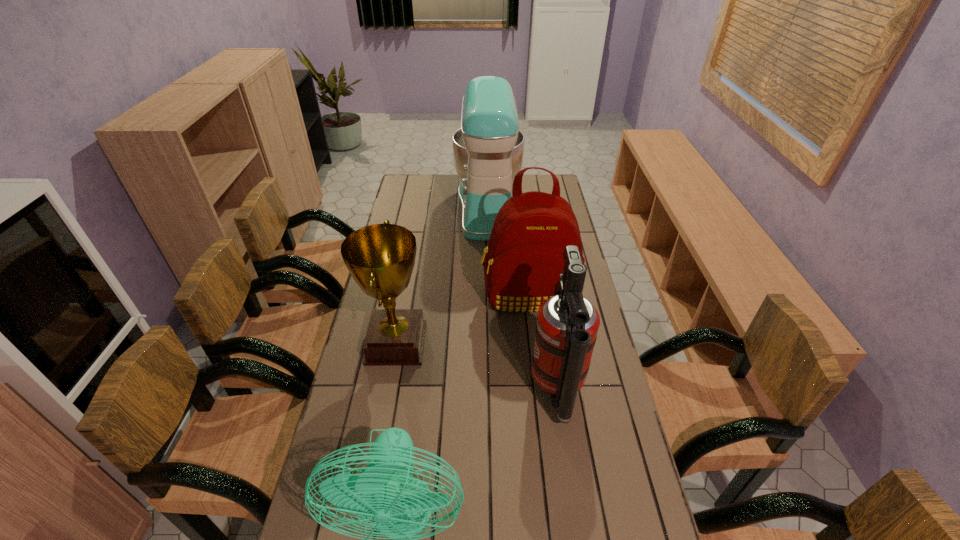
Locate an element on the screen. empty space that is in between the award and the fire extinguisher is located at coordinates (477, 367).

What are the coordinates of `the third closest object to the fire extinguisher` in the screenshot? It's located at (380, 257).

The height and width of the screenshot is (540, 960). What are the coordinates of `object that ranks as the closest to the award` in the screenshot? It's located at (524, 258).

In order to click on vacant space that satisfies the following two spatial constraints: 1. on the front-facing side of the backpack; 2. on the plaque of the award in this screenshot , I will do `click(535, 343)`.

Find the location of a particular element. The height and width of the screenshot is (540, 960). free space in the image that satisfies the following two spatial constraints: 1. on the front-facing side of the backpack; 2. on the plaque of the award is located at coordinates (535, 343).